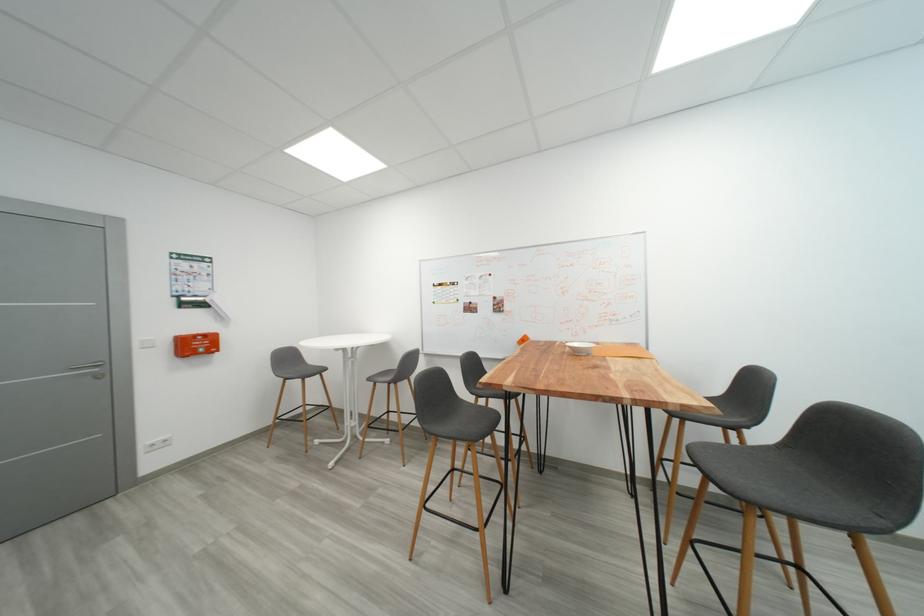
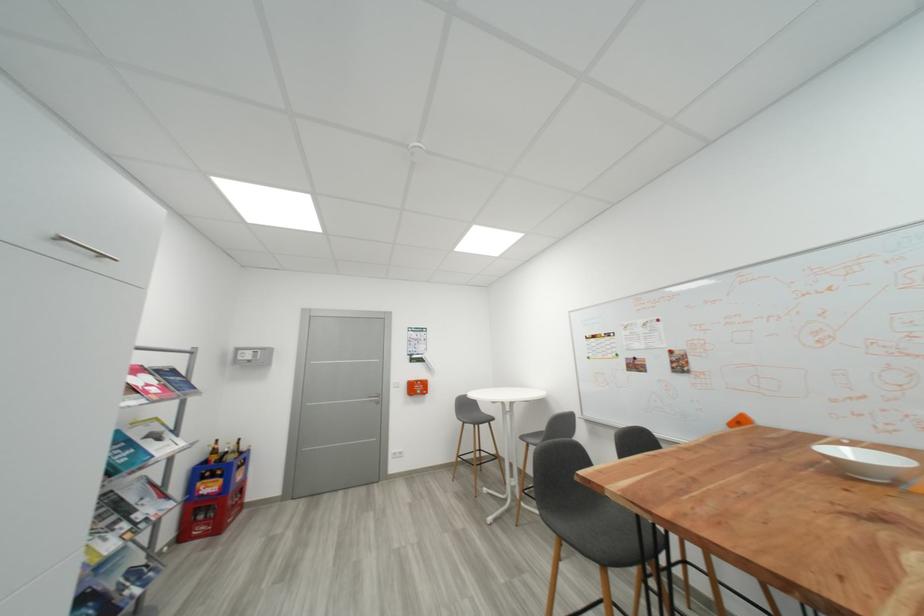
Where in the second image is the point corresponding to [104,379] from the first image?

(383, 405)